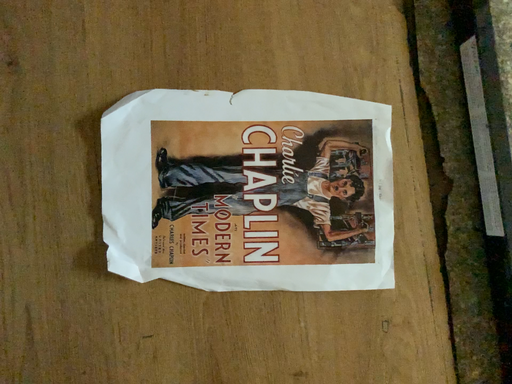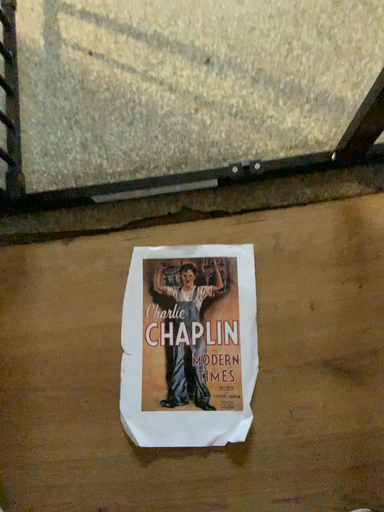
Question: Which way did the camera rotate in the video?

Choices:
 (A) rotated downward
 (B) rotated upward

Answer: (B)